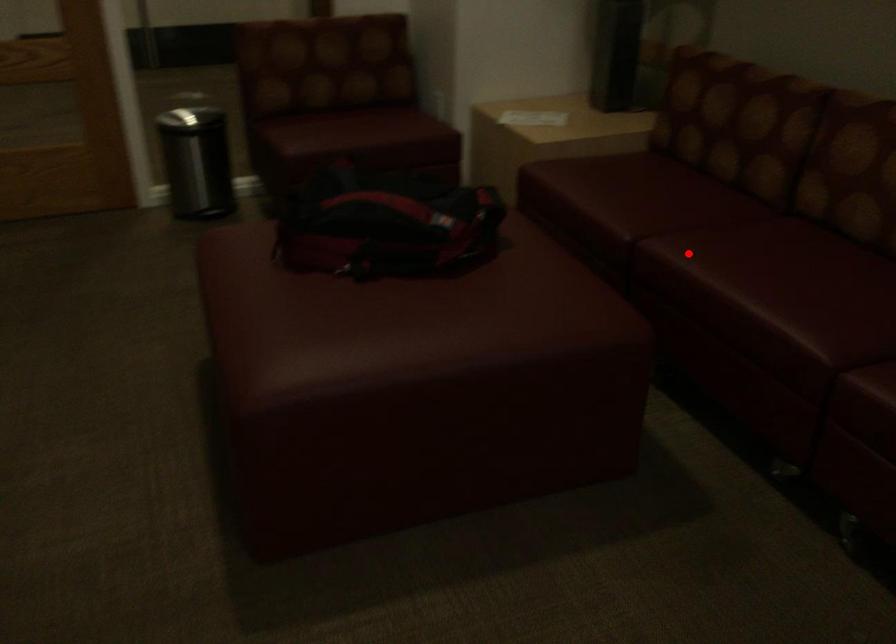
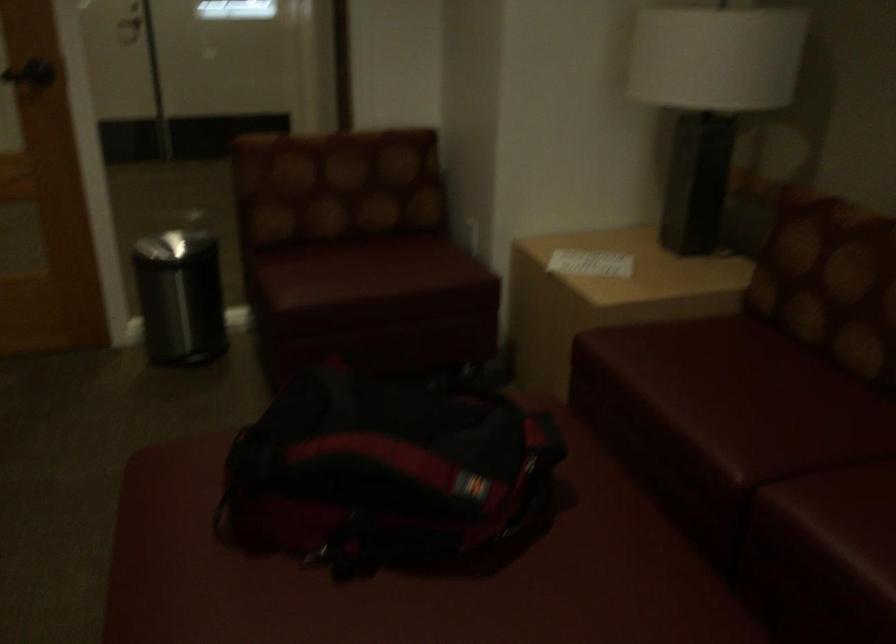
Question: I am providing you with two images of the same scene from different viewpoints. Given a red point in image1, look at the same physical point in image2. Is it:

Choices:
 (A) Closer to the viewpoint
 (B) Farther from the viewpoint

Answer: (A)